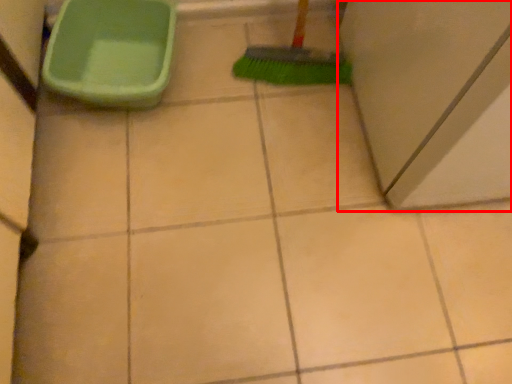
Question: Considering the relative positions of screen door (annotated by the red box) and toilet in the image provided, where is screen door (annotated by the red box) located with respect to the staircase?

Choices:
 (A) left
 (B) right

Answer: (B)